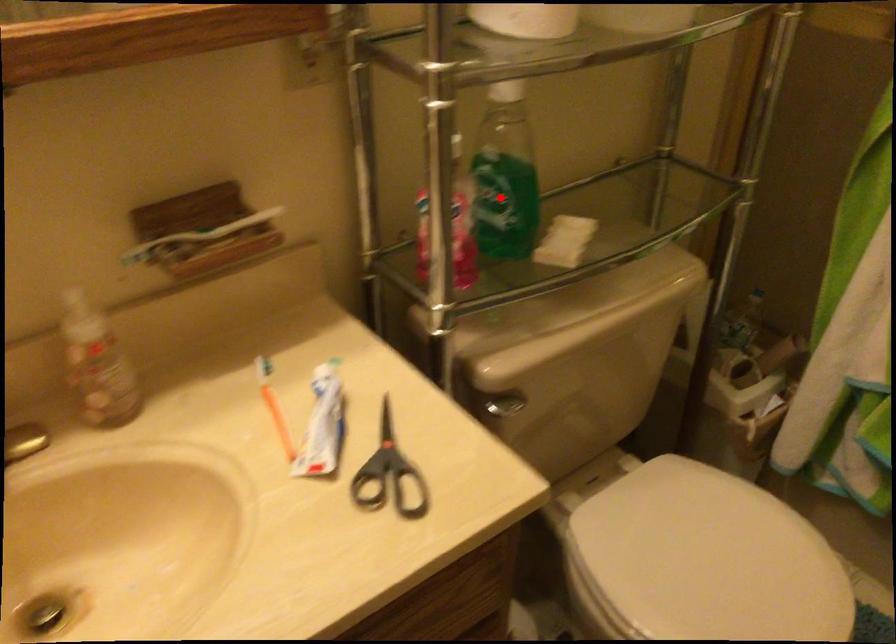
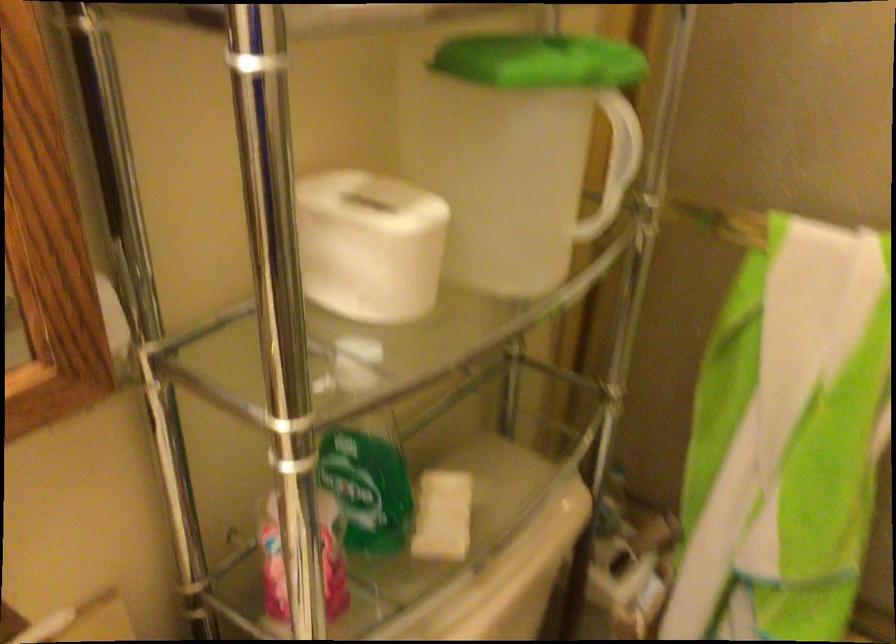
Question: A red point is marked in image1. In image2, is the corresponding 3D point closer to the camera or farther? Reply with the corresponding letter.

Choices:
 (A) The corresponding 3D point is closer.
 (B) The corresponding 3D point is farther.

Answer: (A)